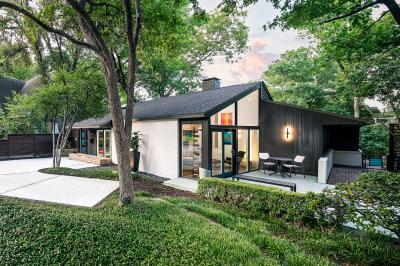
The height and width of the screenshot is (266, 400). In order to click on white and black chairs in this screenshot , I will do pos(295,165), pos(263,163).